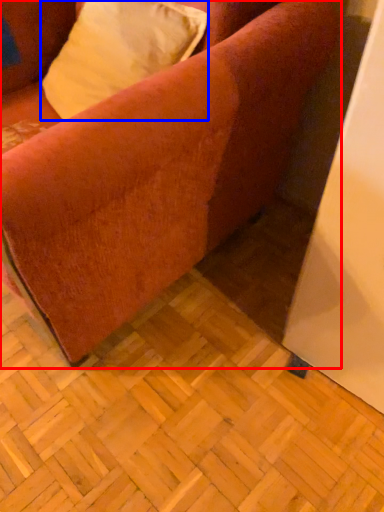
Question: Among these objects, which one is farthest to the camera, studio couch (highlighted by a red box) or pillow (highlighted by a blue box)?

Choices:
 (A) studio couch
 (B) pillow

Answer: (B)